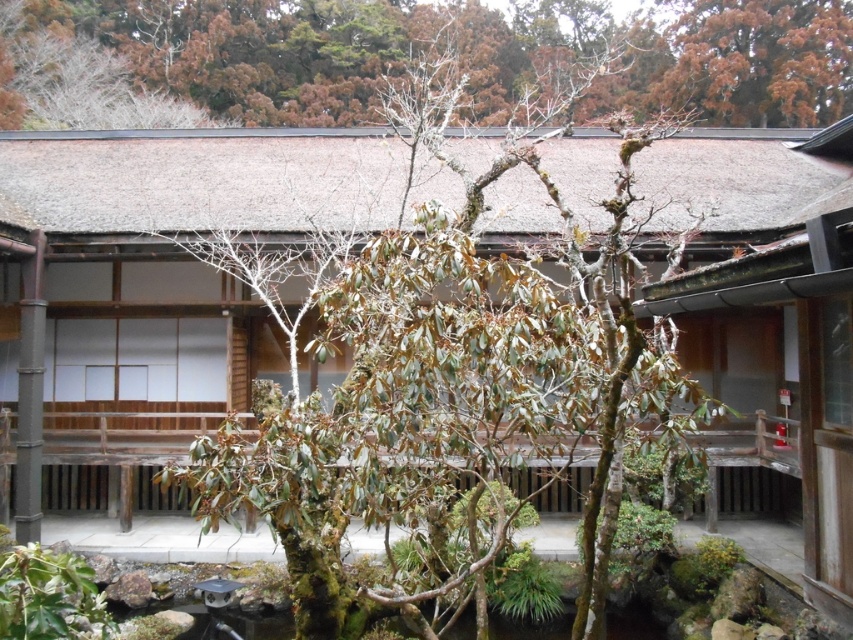
You are a visitor in the courtyard and want to take a photo of both the green leafy tree at center and the green leafy tree at upper center. Which tree should you focus on first to ensure both are in the frame?

You should focus on the green leafy tree at center first because it is larger and will require more space in the frame, ensuring the smaller green leafy tree at upper center also fits.

You are a gardener in the courtyard and need to determine which tree is narrower. Which one is narrower between the green leafy tree at center and the green leafy tree at upper center?

The green leafy tree at center is narrower than the green leafy tree at upper center.

You are standing in the courtyard and want to know which tree is taller between the green leafy tree at center and the green leafy tree at upper center. Can you tell me?

The green leafy tree at center is taller than the green leafy tree at upper center.